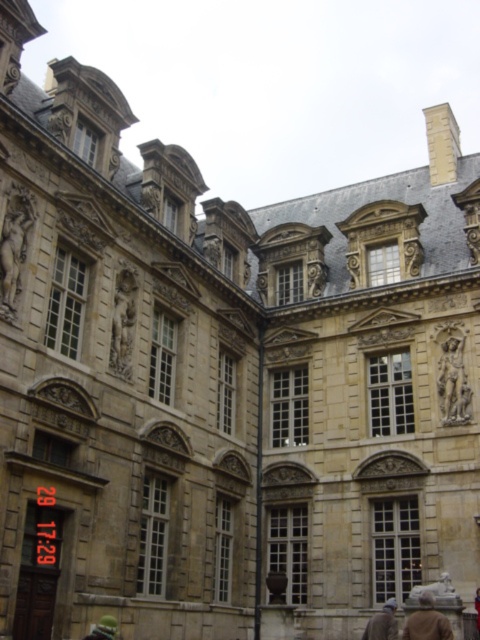
Question: Does stone statue at left appear over bronze statue at upper center?

Choices:
 (A) no
 (B) yes

Answer: (A)

Question: Which object is farther from the camera taking this photo?

Choices:
 (A) green fabric person at lower center
 (B) brown leather jacket at lower right
 (C) bronze statue at upper center

Answer: (C)

Question: Among these points, which one is nearest to the camera?

Choices:
 (A) (316, 291)
 (B) (8, 216)
 (C) (452, 336)
 (D) (392, 625)

Answer: (D)

Question: Which object appears farthest from the camera in this image?

Choices:
 (A) stone statue at center
 (B) bronze statue at upper center

Answer: (B)

Question: Can you confirm if stone statue at center is positioned to the left of bronze statue at upper center?

Choices:
 (A) no
 (B) yes

Answer: (A)

Question: Does polished bronze statue at center have a lesser width compared to bronze statue at upper center?

Choices:
 (A) yes
 (B) no

Answer: (A)